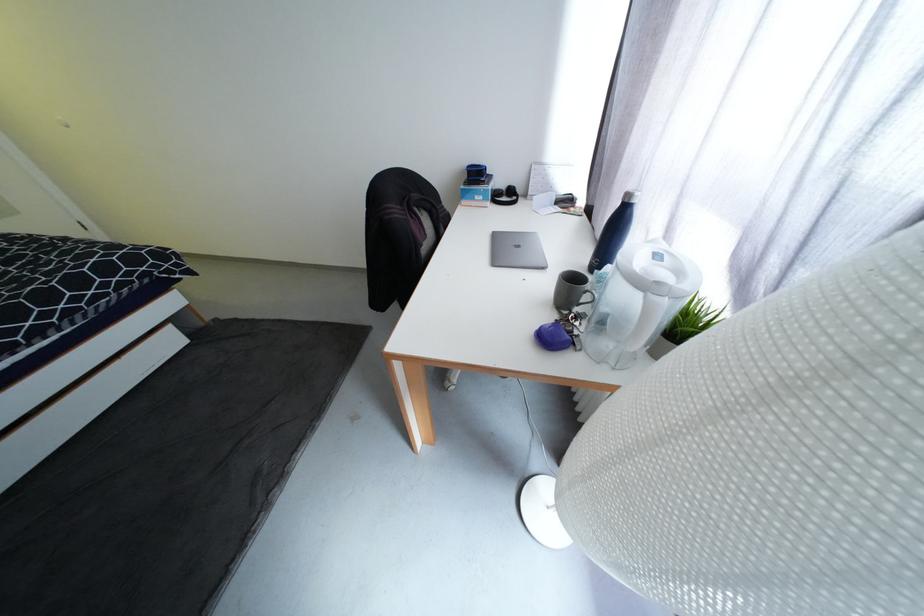
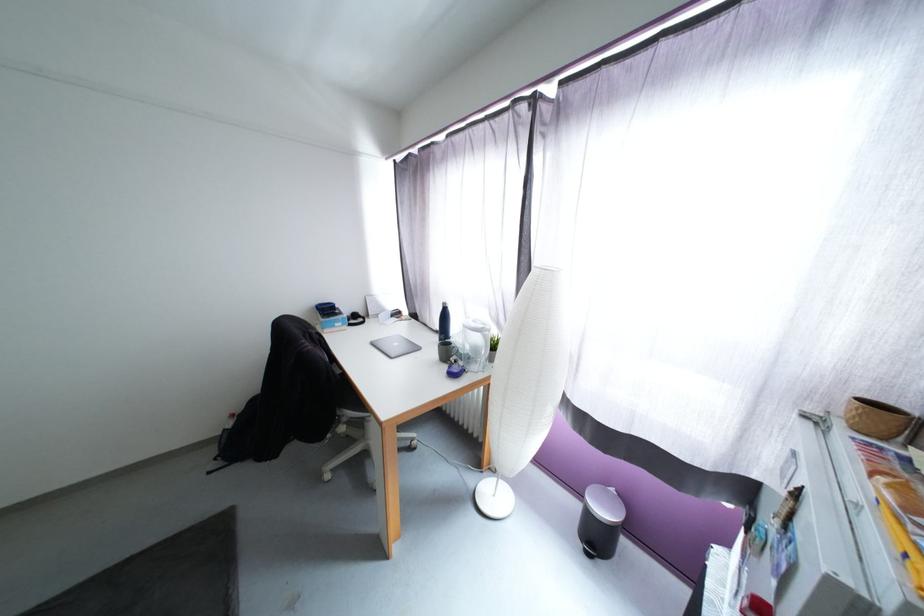
Question: The camera is either moving clockwise (left) or counter-clockwise (right) around the object. The first image is from the beginning of the video and the second image is from the end. Is the camera moving left or right when shooting the video?

Choices:
 (A) Left
 (B) Right

Answer: (A)